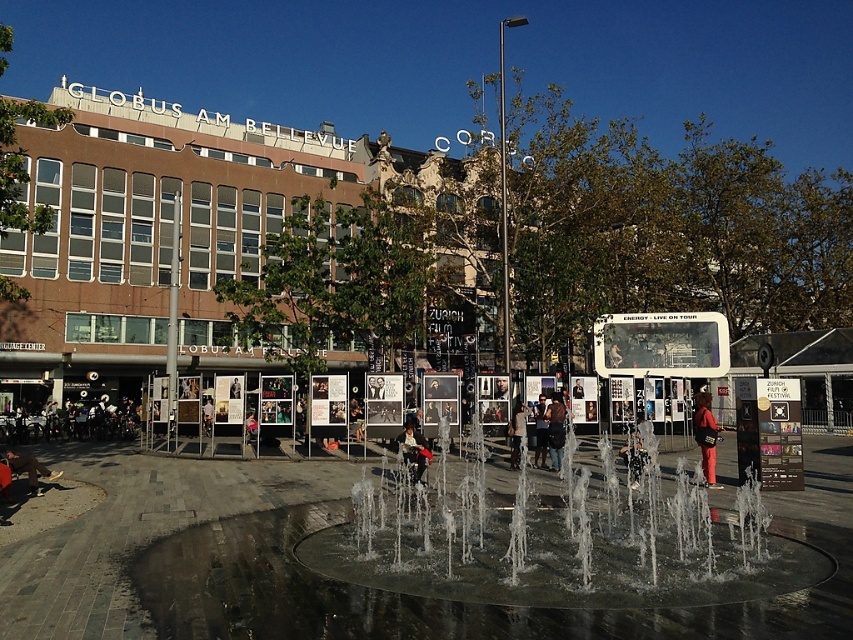
You are standing in the urban outdoor scene and see two jackets. The brown leather jacket at lower left and the dark brown leather jacket at center. Which jacket is shorter in height?

The brown leather jacket at lower left is shorter in height compared to the dark brown leather jacket at center.

You are standing at the edge of the fountain and see the clear glass water at center and the dark brown leather jacket at center. Which object is taller?

The clear glass water at center is much taller than the dark brown leather jacket at center.

You are standing at the edge of the circular fountain and see the clear glass water at center and the dark brown leather jacket at center. You want to pick up the jacket without stepping into the water. Is the jacket within your reach from your current position?

The distance between the clear glass water at center and the dark brown leather jacket at center is 8.08 meters. Since you are at the edge of the fountain, you would need to reach 8.08 meters to get the jacket, which is beyond typical human reach. Therefore, you cannot reach the jacket without stepping into the water.